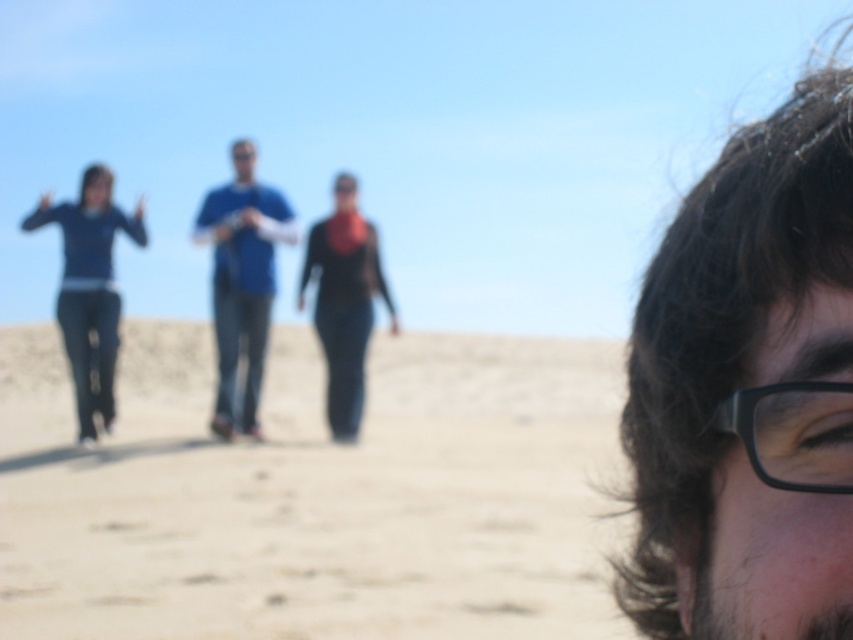
Question: Does beige sandy ground at center have a greater width compared to black plastic glasses at upper right?

Choices:
 (A) no
 (B) yes

Answer: (B)

Question: Is dark brown hair at upper right behind black plastic glasses at upper right?

Choices:
 (A) yes
 (B) no

Answer: (A)

Question: Which object is positioned closest to the black matte jacket at center?

Choices:
 (A) black plastic glasses at upper right
 (B) beige sandy ground at center
 (C) blue fabric shirt at center

Answer: (C)

Question: Is dark brown hair at upper right thinner than blue fabric shirt at center?

Choices:
 (A) no
 (B) yes

Answer: (B)

Question: Which object is the farthest from the beige sandy ground at center?

Choices:
 (A) blue denim jeans at left
 (B) dark brown hair at upper right
 (C) blue fabric shirt at center

Answer: (B)

Question: Estimate the real-world distances between objects in this image. Which object is farther from the black plastic glasses at upper right?

Choices:
 (A) blue denim jeans at left
 (B) blue fabric shirt at center
 (C) dark brown hair at upper right
 (D) beige sandy ground at center

Answer: (D)